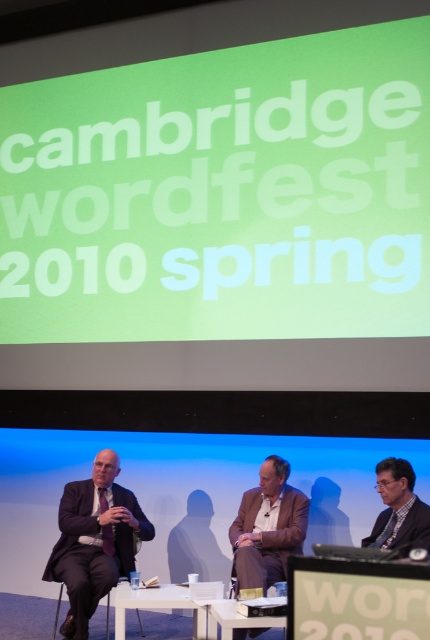
You are attending the Cambridge Wordfest 2010 Spring panel discussion. You notice the matte black suit at left and the white plastic table at center. Which object is positioned higher from the ground?

The matte black suit at left is located above the white plastic table at center, so it is positioned higher from the ground.

You are attending the Cambridge Wordfest 2010 Spring panel discussion and notice the matte black suit at left and the white plastic table at center. Which object is taller?

The matte black suit at left is taller than the white plastic table at center.

You are attending the Cambridge Wordfest 2010 Spring and want to take a photo of the panelists. The person in the matte black suit at left is blocking your view of the brown leather jacket at center. Can you suggest a position to move to so you can see both panelists clearly?

Move behind the brown leather jacket at center so that it is no longer blocked by the matte black suit at left, since the brown leather jacket at center is positioned behind the matte black suit at left.